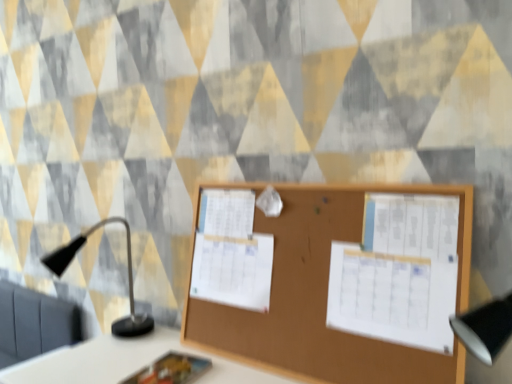
Describe the element at coordinates (233, 270) in the screenshot. The image size is (512, 384). I see `white paper at center, which is the 2th poster in front-to-back order` at that location.

This screenshot has height=384, width=512. Identify the location of white paper at center, the 1th poster viewed from the left. 233,270.

Describe the element at coordinates (170, 370) in the screenshot. Image resolution: width=512 pixels, height=384 pixels. I see `matte plastic notebook at lower center` at that location.

Measure the distance between matte plastic notebook at lower center and camera.

The depth of matte plastic notebook at lower center is 3.70 feet.

In order to click on brown wood bulletin board at center in this screenshot , I will do `click(323, 297)`.

Measure the distance between point (330, 194) and camera.

They are 3.65 feet apart.

This screenshot has height=384, width=512. What are the coordinates of `white paper at center, the 1th poster viewed from the left` in the screenshot? It's located at (233, 270).

Is matte plastic notebook at lower center taller or shorter than white paper at center, the first poster from the front?

Considering their sizes, matte plastic notebook at lower center has less height than white paper at center, the first poster from the front.

Is matte plastic notebook at lower center aimed at white paper at center, the second poster viewed from the back?

No, matte plastic notebook at lower center is not oriented towards white paper at center, the second poster viewed from the back.

Based on their positions, is matte plastic notebook at lower center located to the left or right of white paper at center, the second poster viewed from the back?

From the image, it's evident that matte plastic notebook at lower center is to the left of white paper at center, the second poster viewed from the back.

In the scene shown: Can you confirm if matte plastic notebook at lower center is wider than white paper at center, the second poster viewed from the back?

Indeed, matte plastic notebook at lower center has a greater width compared to white paper at center, the second poster viewed from the back.

Is white paper at center, which is the first poster from right to left, at the back of white paper at center, which is the 2th poster in front-to-back order?

white paper at center, which is the 2th poster in front-to-back order, is not turned away from white paper at center, which is the first poster from right to left.

From the image's perspective, is white paper at center, which is the 2th poster in front-to-back order, positioned above or below white paper at center, which is the first poster from right to left?

Clearly, from the image's perspective, white paper at center, which is the 2th poster in front-to-back order, is above white paper at center, which is the first poster from right to left.

Is white paper at center, placed as the first poster when sorted from back to front, behind white paper at center, the second poster viewed from the back?

Yes, the depth of white paper at center, placed as the first poster when sorted from back to front, is greater than that of white paper at center, the second poster viewed from the back.

How many degrees apart are the facing directions of white paper at center, which is the 2th poster in front-to-back order, and black matte table lamp at left?

The facing directions of white paper at center, which is the 2th poster in front-to-back order, and black matte table lamp at left are 7.61 degrees apart.

Who is taller, white paper at center, placed as the first poster when sorted from back to front, or black matte table lamp at left?

With more height is black matte table lamp at left.

Starting from the black matte table lamp at left, which poster is the 1st one in front? Please provide its 2D coordinates.

[(233, 270)]

Can you confirm if white paper at center, placed as the first poster when sorted from back to front, is bigger than black matte table lamp at left?

Incorrect, white paper at center, placed as the first poster when sorted from back to front, is not larger than black matte table lamp at left.

Where is `bulletin board above the matte plastic notebook at lower center (from the image's perspective)`? This screenshot has width=512, height=384. bulletin board above the matte plastic notebook at lower center (from the image's perspective) is located at coordinates (323, 297).

Are matte plastic notebook at lower center and brown wood bulletin board at center located far from each other?

They are positioned close to each other.

Can you confirm if matte plastic notebook at lower center is taller than brown wood bulletin board at center?

In fact, matte plastic notebook at lower center may be shorter than brown wood bulletin board at center.

Is matte plastic notebook at lower center positioned beyond the bounds of brown wood bulletin board at center?

Yes, matte plastic notebook at lower center is not within brown wood bulletin board at center.

From the image's perspective, which object appears higher, black matte table lamp at left or white paper at center, positioned as the 2th poster in left-to-right order?

white paper at center, positioned as the 2th poster in left-to-right order, is shown above in the image.

Is point (126, 321) closer or farther from the camera than point (436, 272)?

Point (126, 321) appears to be farther away from the viewer than point (436, 272).

Visually, is black matte table lamp at left positioned to the left or to the right of white paper at center, the second poster viewed from the back?

Clearly, black matte table lamp at left is on the left of white paper at center, the second poster viewed from the back, in the image.

In the scene shown: Which of these two, white paper at center, the second poster viewed from the back, or white paper at center, the 1th poster viewed from the left, stands taller?

With more height is white paper at center, the second poster viewed from the back.

Is white paper at center, the second poster viewed from the back, to the right of white paper at center, the 1th poster viewed from the left, from the viewer's perspective?

Yes, white paper at center, the second poster viewed from the back, is to the right of white paper at center, the 1th poster viewed from the left.

From the image's perspective, is white paper at center, the first poster from the front, over white paper at center, the second poster viewed from the right?

No, from the image's perspective, white paper at center, the first poster from the front, is not above white paper at center, the second poster viewed from the right.

Is brown wood bulletin board at center completely or partially outside of matte plastic notebook at lower center?

Indeed, brown wood bulletin board at center is completely outside matte plastic notebook at lower center.

This screenshot has width=512, height=384. Find the location of `bulletin board located in front of the matte plastic notebook at lower center`. bulletin board located in front of the matte plastic notebook at lower center is located at coordinates (323, 297).

Is brown wood bulletin board at center bigger or smaller than matte plastic notebook at lower center?

Considering their sizes, brown wood bulletin board at center takes up more space than matte plastic notebook at lower center.

From the image's perspective, who appears lower, brown wood bulletin board at center or matte plastic notebook at lower center?

matte plastic notebook at lower center is shown below in the image.

The width and height of the screenshot is (512, 384). In order to click on the 2nd poster counting from the right side of the matte plastic notebook at lower center in this screenshot , I will do `click(399, 272)`.

At what (x,y) coordinates should I click in order to perform the action: click on poster above the white paper at center, positioned as the 2th poster in left-to-right order (from the image's perspective). Please return your answer as a coordinate pair (x, y). The image size is (512, 384). Looking at the image, I should click on (233, 270).

Estimate the real-world distances between objects in this image. Which object is further from white paper at center, the 1th poster viewed from the left, black matte table lamp at left or white paper at center, which is the first poster from right to left?

black matte table lamp at left.

Which object lies nearer to the anchor point black matte table lamp at left, white paper at center, the 1th poster viewed from the left, or brown wood bulletin board at center?

The object closer to black matte table lamp at left is white paper at center, the 1th poster viewed from the left.

Estimate the real-world distances between objects in this image. Which object is further from white paper at center, placed as the first poster when sorted from back to front, white paper at center, which is the first poster from right to left, or brown wood bulletin board at center?

Among the two, white paper at center, which is the first poster from right to left, is located further to white paper at center, placed as the first poster when sorted from back to front.

From the image, which object appears to be farther from brown wood bulletin board at center, matte plastic notebook at lower center or white paper at center, the first poster from the front?

Among the two, matte plastic notebook at lower center is located further to brown wood bulletin board at center.

Looking at the image, which one is located closer to white paper at center, which is the first poster from right to left, matte plastic notebook at lower center or brown wood bulletin board at center?

brown wood bulletin board at center lies closer to white paper at center, which is the first poster from right to left, than the other object.

Looking at this image, from the image, which object appears to be nearer to white paper at center, the first poster from the front, matte plastic notebook at lower center or black matte table lamp at left?

Based on the image, matte plastic notebook at lower center appears to be nearer to white paper at center, the first poster from the front.

Based on their spatial positions, is brown wood bulletin board at center or white paper at center, the second poster viewed from the right, closer to matte plastic notebook at lower center?

white paper at center, the second poster viewed from the right, is positioned closer to the anchor matte plastic notebook at lower center.

Estimate the real-world distances between objects in this image. Which object is closer to black matte table lamp at left, brown wood bulletin board at center or matte plastic notebook at lower center?

matte plastic notebook at lower center lies closer to black matte table lamp at left than the other object.

The width and height of the screenshot is (512, 384). Find the location of `poster between matte plastic notebook at lower center and brown wood bulletin board at center from left to right`. poster between matte plastic notebook at lower center and brown wood bulletin board at center from left to right is located at coordinates (233, 270).

This screenshot has height=384, width=512. I want to click on notebook between black matte table lamp at left and white paper at center, the second poster viewed from the right, from left to right, so click(x=170, y=370).

You are a GUI agent. You are given a task and a screenshot of the screen. Output one action in this format:
    pyautogui.click(x=<x>, y=<y>)
    Task: Click on the bulletin board situated between matte plastic notebook at lower center and white paper at center, the first poster from the front, from left to right
    This screenshot has height=384, width=512.
    Given the screenshot: What is the action you would take?
    pyautogui.click(x=323, y=297)

This screenshot has height=384, width=512. I want to click on notebook situated between black matte table lamp at left and white paper at center, the second poster viewed from the back, from left to right, so click(170, 370).